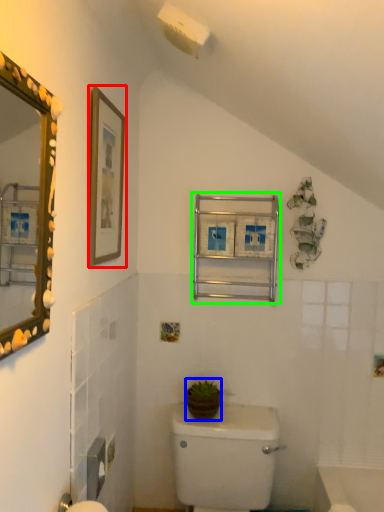
Question: Considering the real-world distances, which object is farthest from picture frame (highlighted by a red box)? plant (highlighted by a blue box) or medicine cabinet (highlighted by a green box)?

Choices:
 (A) plant
 (B) medicine cabinet

Answer: (A)